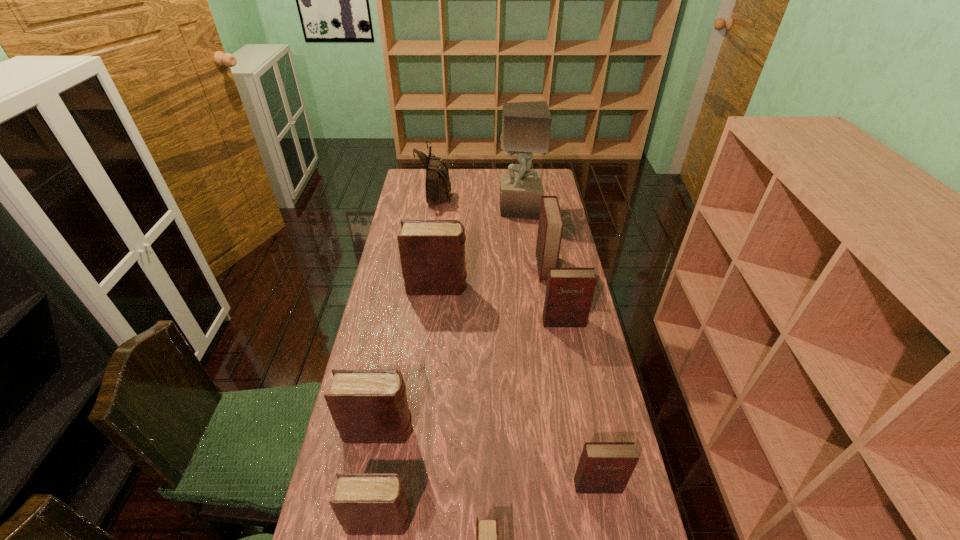
Locate an element on the screen. The image size is (960, 540). free spot located on the spine side of the farthest brown diary is located at coordinates (559, 287).

Locate an element on the screen. This screenshot has width=960, height=540. vacant space located 0.270m on the spine side of the third smallest brown diary is located at coordinates (512, 430).

This screenshot has width=960, height=540. What are the coordinates of `free region located on the front cover of the fifth farthest object` in the screenshot? It's located at (571, 363).

The image size is (960, 540). Find the location of `free space located 0.320m on the spine side of the second nearest brown diary`. free space located 0.320m on the spine side of the second nearest brown diary is located at coordinates (547, 521).

The image size is (960, 540). Identify the location of vacant area located on the front cover of the nearest reddish-brown diary. (604, 520).

At what (x,y) coordinates should I click in order to perform the action: click on object that is positioned at the far edge. Please return your answer as a coordinate pair (x, y). This screenshot has height=540, width=960. Looking at the image, I should click on (438, 185).

Locate an element on the screen. shoulder bag that is positioned at the left edge is located at coordinates (438, 185).

Locate an element on the screen. Image resolution: width=960 pixels, height=540 pixels. sculpture that is at the right edge is located at coordinates (526, 126).

At what (x,y) coordinates should I click in order to perform the action: click on object that is at the far left corner. Please return your answer as a coordinate pair (x, y). The width and height of the screenshot is (960, 540). Looking at the image, I should click on (438, 185).

What are the coordinates of `vacant region at the left edge of the desktop` in the screenshot? It's located at pos(394,348).